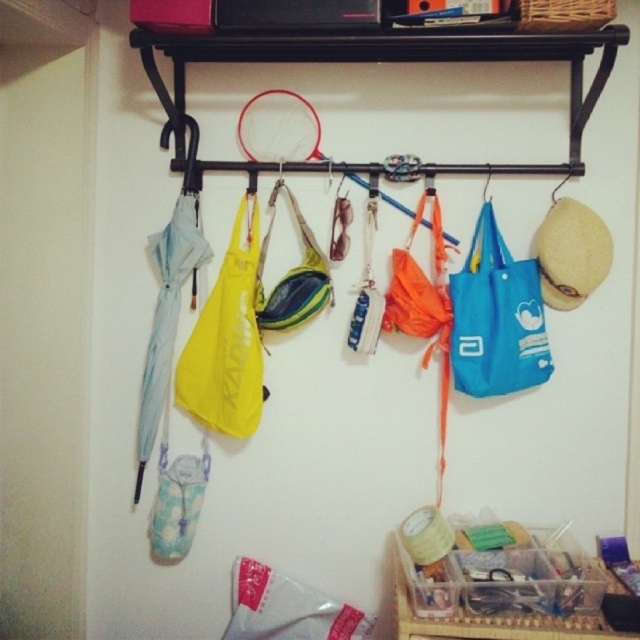
Can you confirm if blue fabric bag at center-right is positioned to the left of yellow fabric pouch at center?

No, blue fabric bag at center-right is not to the left of yellow fabric pouch at center.

Who is shorter, blue fabric bag at center-right or yellow fabric pouch at center?

yellow fabric pouch at center

In the scene shown: Who is more distant from viewer, (488,200) or (285,189)?

The point (285,189) is behind.

What are the coordinates of `blue fabric bag at center-right` in the screenshot? It's located at pos(497,317).

Which of these two, blue fabric bag at center-right or yellow fabric bag at center, stands shorter?

blue fabric bag at center-right is shorter.

You are a GUI agent. You are given a task and a screenshot of the screen. Output one action in this format:
    pyautogui.click(x=<x>, y=<y>)
    Task: Click on the blue fabric bag at center-right
    The image size is (640, 640).
    Given the screenshot: What is the action you would take?
    pyautogui.click(x=497, y=317)

Locate an element on the screen. The image size is (640, 640). blue fabric bag at center-right is located at coordinates (497, 317).

Does point (250, 365) come farther from viewer compared to point (294, 314)?

Yes, point (250, 365) is farther from viewer.

Is yellow fabric bag at center smaller than yellow fabric pouch at center?

Incorrect, yellow fabric bag at center is not smaller in size than yellow fabric pouch at center.

Between point (241, 298) and point (257, 312), which one is positioned in front?

Positioned in front is point (241, 298).

Find the location of `yellow fabric bag at center`. yellow fabric bag at center is located at coordinates (227, 339).